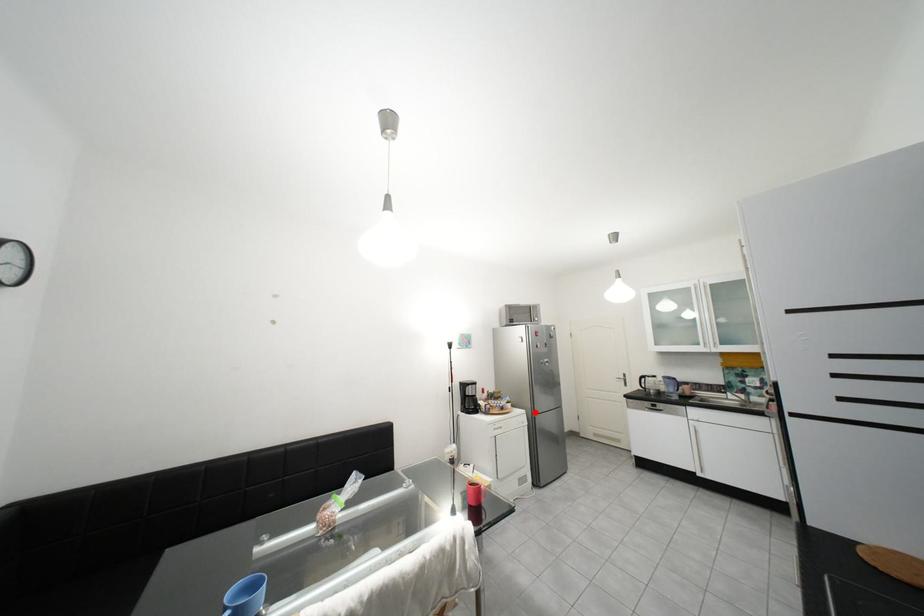
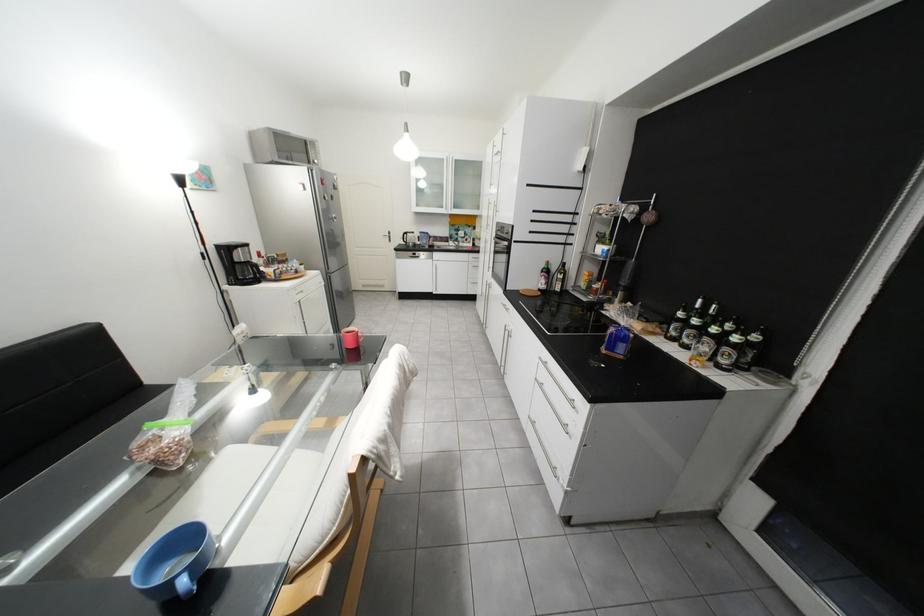
Question: I am providing you with two images of the same scene from different viewpoints. Image1 has a red point marked. In image2, the corresponding 3D location appears at what relative position? Reply with the corresponding letter.

Choices:
 (A) Closer
 (B) Farther

Answer: (A)